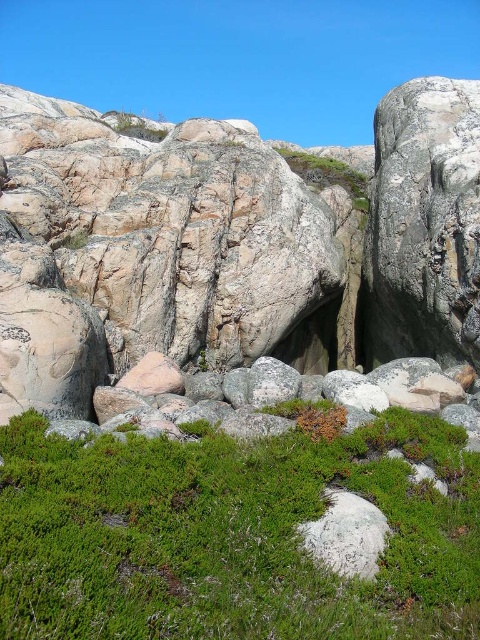
Question: Can you confirm if gray/rough rock face at center is positioned to the right of green soft grass at lower center?

Choices:
 (A) no
 (B) yes

Answer: (A)

Question: Observing the image, what is the correct spatial positioning of gray/rough rock face at center in reference to green soft grass at lower center?

Choices:
 (A) right
 (B) left

Answer: (B)

Question: Estimate the real-world distances between objects in this image. Which object is farther from the green soft grass at lower center?

Choices:
 (A) smooth rock hole at center
 (B) gray/rough rock face at center

Answer: (A)

Question: Which object is positioned farthest from the gray/rough rock face at center?

Choices:
 (A) smooth rock hole at center
 (B) green soft grass at lower center

Answer: (B)

Question: Which point appears farthest from the camera in this image?

Choices:
 (A) (309, 502)
 (B) (311, 268)
 (C) (297, 333)

Answer: (C)

Question: Is gray/rough rock face at center wider than smooth rock hole at center?

Choices:
 (A) no
 (B) yes

Answer: (B)